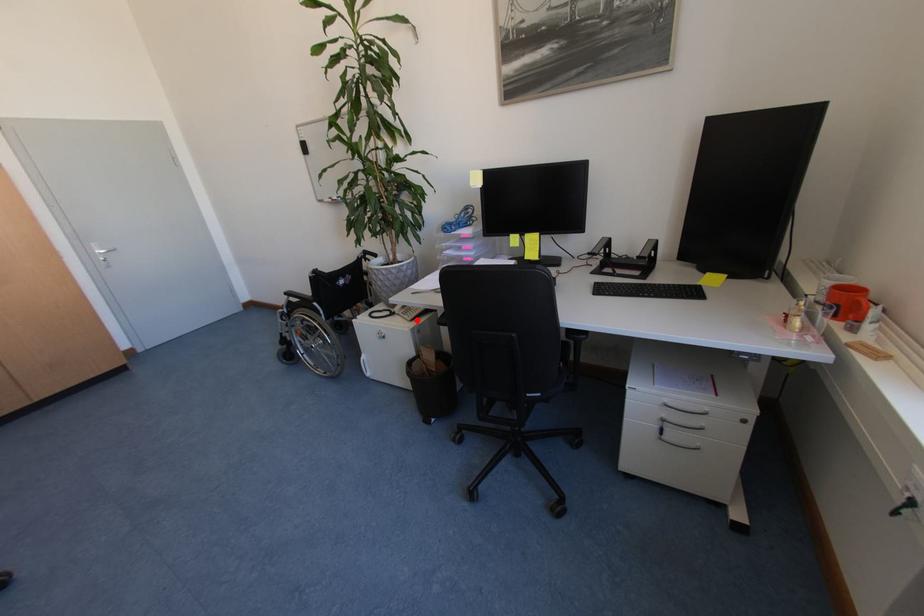
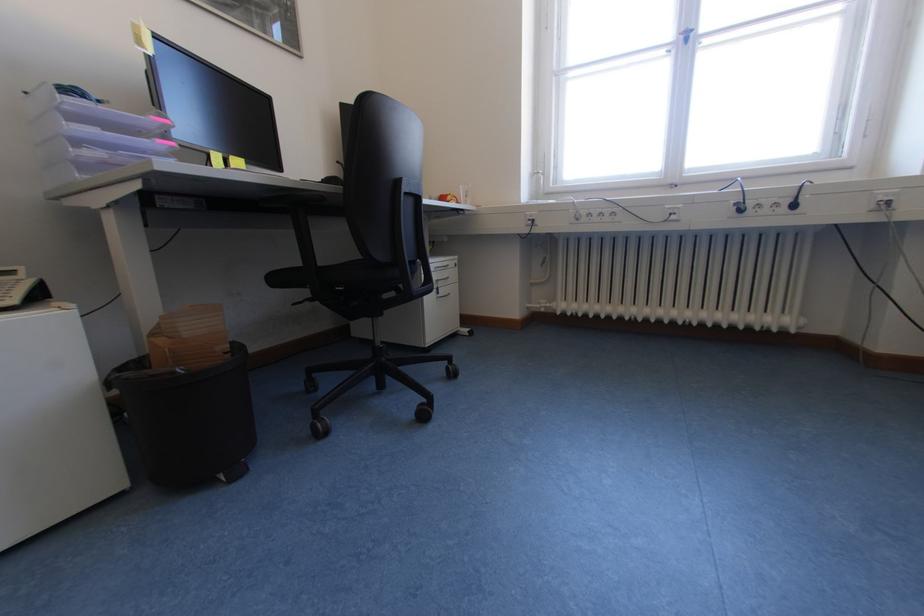
The point at the highlighted location is marked in the first image. Where is the corresponding point in the second image?

(21, 302)